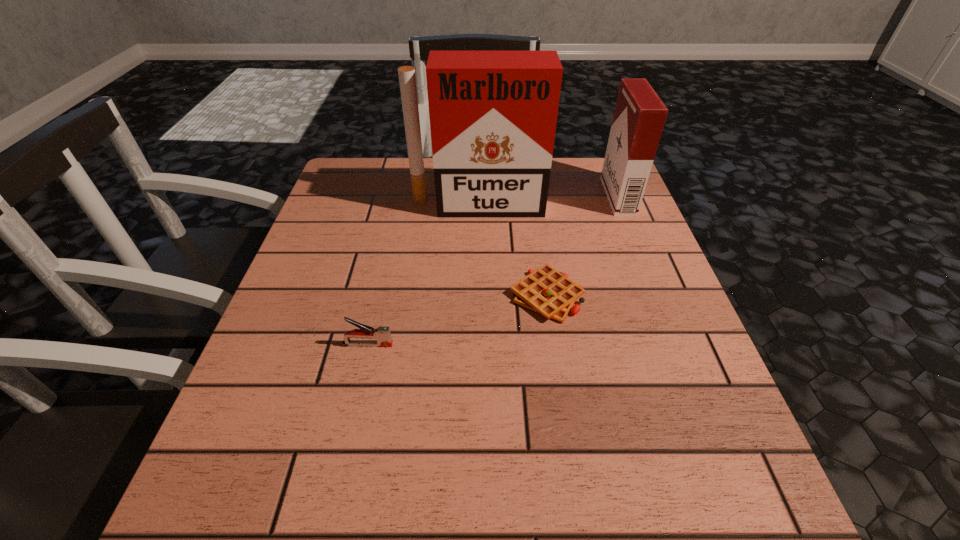
Locate an element on the screen. This screenshot has height=540, width=960. free region that satisfies the following two spatial constraints: 1. on the front-facing side of the right cigarette_case; 2. on the front-facing side of the left cigarette_case is located at coordinates (621, 205).

Where is `free space that satisfies the following two spatial constraints: 1. on the front-facing side of the taller cigarette_case; 2. on the handle side of the stapler`? free space that satisfies the following two spatial constraints: 1. on the front-facing side of the taller cigarette_case; 2. on the handle side of the stapler is located at coordinates pyautogui.click(x=477, y=345).

Locate an element on the screen. This screenshot has height=540, width=960. free space that satisfies the following two spatial constraints: 1. on the front-facing side of the rightmost object; 2. on the front-facing side of the tallest object is located at coordinates (621, 205).

Image resolution: width=960 pixels, height=540 pixels. Identify the location of free location that satisfies the following two spatial constraints: 1. on the front-facing side of the tallest object; 2. on the handle side of the nearest object. (477, 345).